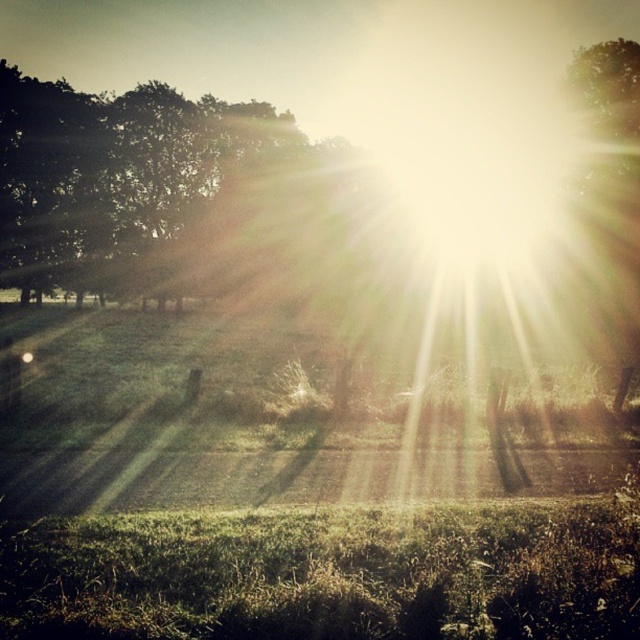
Question: Observing the image, what is the correct spatial positioning of green leafy tree at upper left in reference to green leafy tree at upper right?

Choices:
 (A) left
 (B) right

Answer: (A)

Question: Among these points, which one is farthest from the camera?

Choices:
 (A) (636, 90)
 (B) (1, 173)

Answer: (B)

Question: Is green leafy tree at upper left positioned at the back of green leafy tree at upper right?

Choices:
 (A) no
 (B) yes

Answer: (B)

Question: Is green leafy tree at upper left further to the viewer compared to green leafy tree at upper right?

Choices:
 (A) no
 (B) yes

Answer: (B)

Question: Among these points, which one is nearest to the camera?

Choices:
 (A) tap(592, 72)
 (B) tap(12, 65)

Answer: (A)